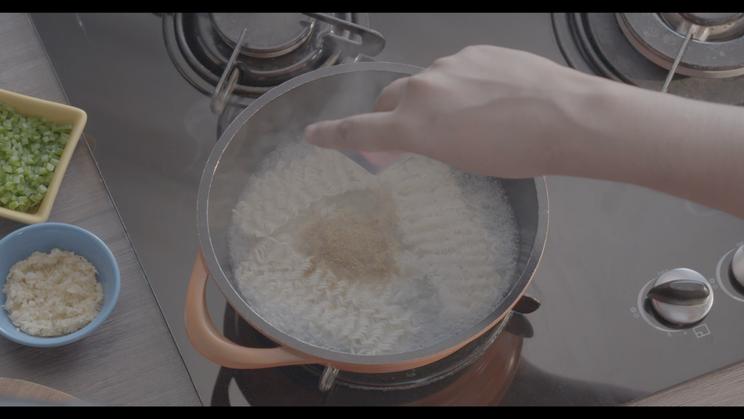
At what (x,y) coordinates should I click in order to perform the action: click on counter. Please return your answer as a coordinate pair (x, y). Looking at the image, I should click on (125, 361).